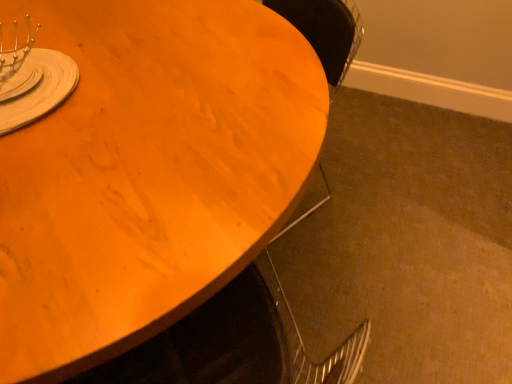
Question: Could you tell me if wooden table at upper left is facing matte silver fork at upper left?

Choices:
 (A) yes
 (B) no

Answer: (B)

Question: From the image's perspective, is wooden table at upper left on top of matte silver fork at upper left?

Choices:
 (A) no
 (B) yes

Answer: (A)

Question: Can you confirm if wooden table at upper left is smaller than matte silver fork at upper left?

Choices:
 (A) yes
 (B) no

Answer: (B)

Question: Does wooden table at upper left appear on the right side of matte silver fork at upper left?

Choices:
 (A) no
 (B) yes

Answer: (B)

Question: Is wooden table at upper left completely or partially outside of matte silver fork at upper left?

Choices:
 (A) no
 (B) yes

Answer: (B)

Question: Does wooden table at upper left have a greater width compared to matte silver fork at upper left?

Choices:
 (A) no
 (B) yes

Answer: (B)

Question: Is matte silver fork at upper left in contact with wooden table at upper left?

Choices:
 (A) yes
 (B) no

Answer: (B)

Question: From the image's perspective, would you say matte silver fork at upper left is positioned over wooden table at upper left?

Choices:
 (A) yes
 (B) no

Answer: (A)

Question: Considering the relative sizes of matte silver fork at upper left and wooden table at upper left in the image provided, is matte silver fork at upper left thinner than wooden table at upper left?

Choices:
 (A) no
 (B) yes

Answer: (B)

Question: From the image's perspective, is matte silver fork at upper left beneath wooden table at upper left?

Choices:
 (A) no
 (B) yes

Answer: (A)

Question: Is matte silver fork at upper left wider than wooden table at upper left?

Choices:
 (A) yes
 (B) no

Answer: (B)

Question: Is matte silver fork at upper left oriented away from wooden table at upper left?

Choices:
 (A) no
 (B) yes

Answer: (A)

Question: In terms of size, does matte silver fork at upper left appear bigger or smaller than wooden table at upper left?

Choices:
 (A) big
 (B) small

Answer: (B)